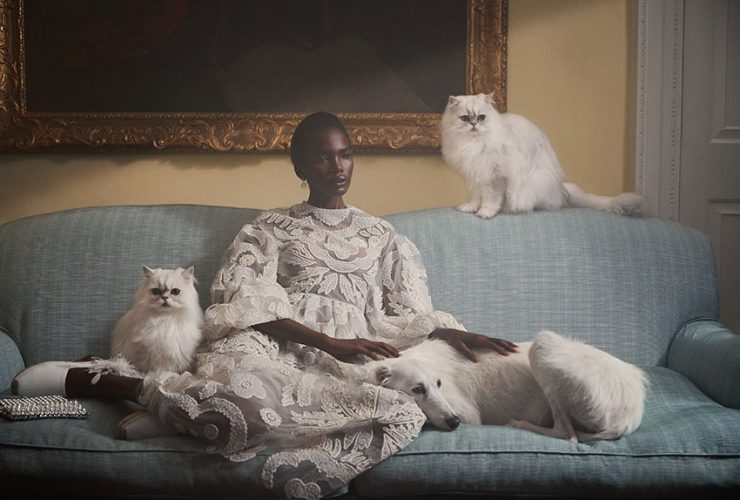
Locate an element on the screen. The image size is (740, 500). painting is located at coordinates (63, 77).